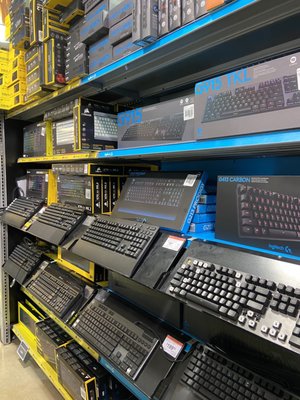
Locate an element on the screen. The height and width of the screenshot is (400, 300). light brown floor surface is located at coordinates (14, 383).